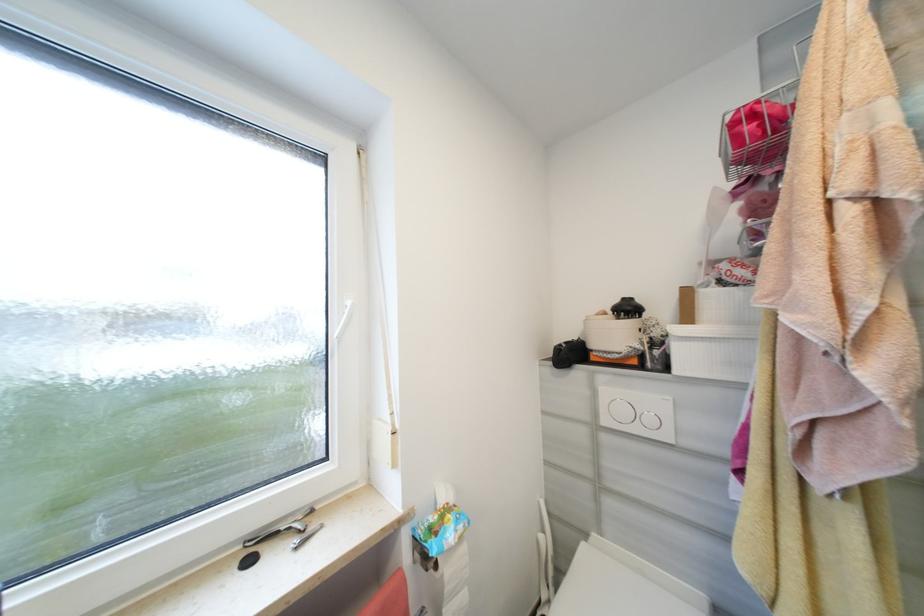
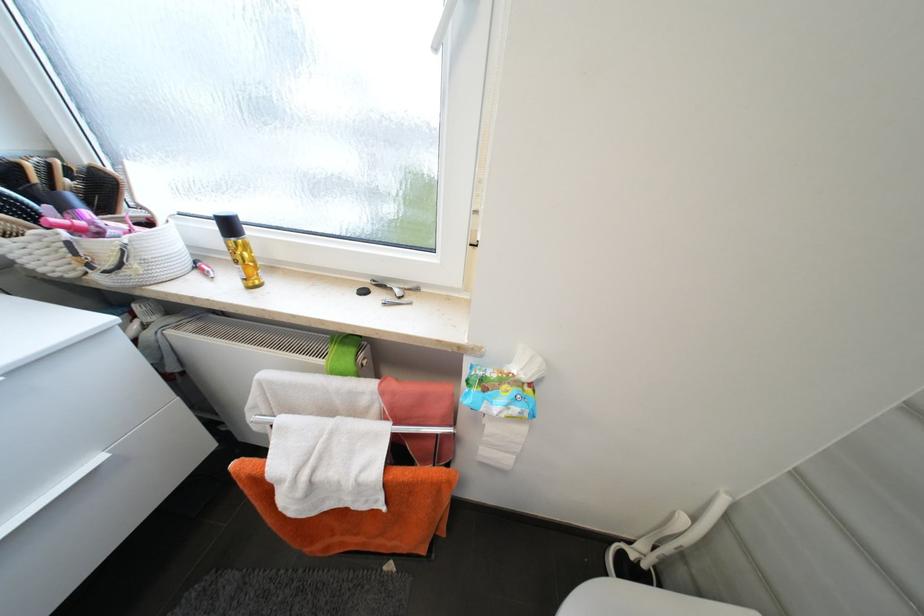
Based on the photo, based on the continuous images, in which direction is the camera rotating?

The camera rotated toward left-down.